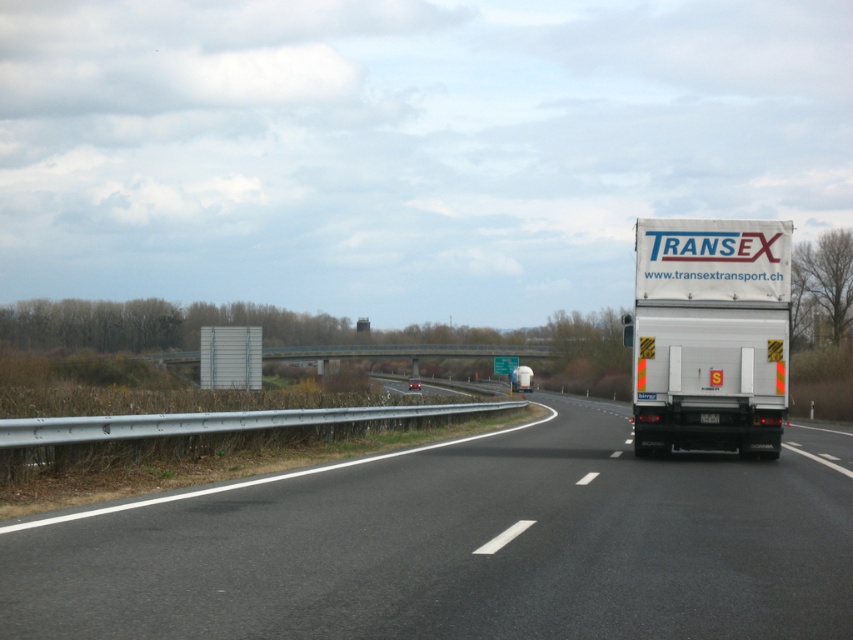
Between black asphalt highway at center and white matte trailer truck at right, which one appears on the right side from the viewer's perspective?

white matte trailer truck at right

Does point (16, 618) lie behind point (692, 330)?

No, it is in front of (692, 330).

Locate an element on the screen. black asphalt highway at center is located at coordinates (462, 545).